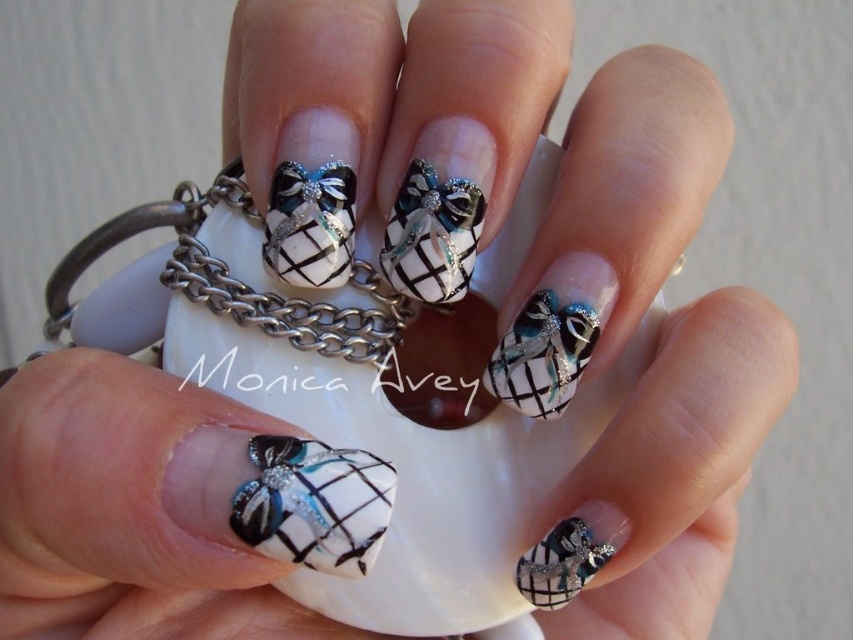
Does matte black bow at center have a smaller size compared to matte black and white checkered nail art at center?

Yes, matte black bow at center is smaller than matte black and white checkered nail art at center.

Is matte black bow at center positioned behind matte black and white checkered nail art at center?

No, matte black bow at center is in front of matte black and white checkered nail art at center.

The width and height of the screenshot is (853, 640). What do you see at coordinates (432, 236) in the screenshot? I see `matte black bow at center` at bounding box center [432, 236].

Where is `matte black bow at center`? Image resolution: width=853 pixels, height=640 pixels. matte black bow at center is located at coordinates (432, 236).

Is matte black and white nail art with bow at center smaller than matte black nail art at center?

Incorrect, matte black and white nail art with bow at center is not smaller in size than matte black nail art at center.

Can you confirm if matte black and white nail art with bow at center is positioned to the right of matte black nail art at center?

In fact, matte black and white nail art with bow at center is to the left of matte black nail art at center.

Identify the location of matte black and white nail art with bow at center. (312, 502).

Is matte black and white checkered bow at center smaller than matte black and white checkered nail art at center?

Indeed, matte black and white checkered bow at center has a smaller size compared to matte black and white checkered nail art at center.

Between matte black and white checkered bow at center and matte black and white checkered nail art at center, which one appears on the left side from the viewer's perspective?

matte black and white checkered bow at center

The width and height of the screenshot is (853, 640). In order to click on matte black and white checkered bow at center in this screenshot , I will do `click(310, 225)`.